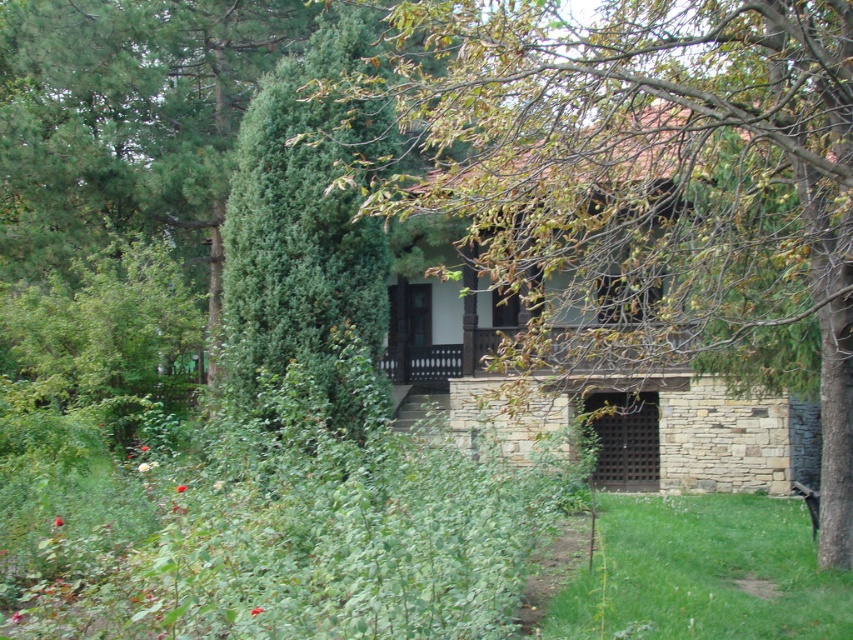
You are standing in front of the rustic house and see two points marked on the image. The first is at point (x=817, y=208) and the second is at point (x=332, y=38). Which point is closer to you?

Point (x=817, y=208) is in front of point (x=332, y=38), so it is closer to you.

You are standing in front of the rustic house and notice two plants at the center of the scene. Which one is taller between the green leafy tree at center and the green textured bush at center?

The green leafy tree at center is taller than the green textured bush at center.